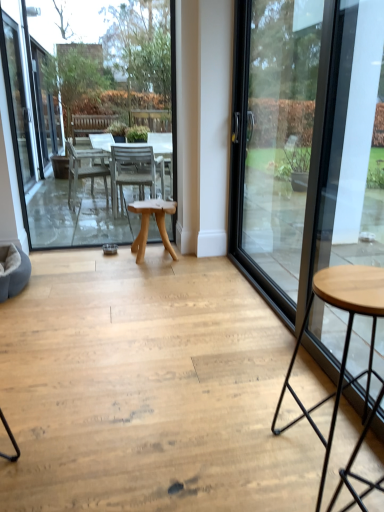
Question: From their relative heights in the image, would you say wooden table at center is taller or shorter than natural wood table at center?

Choices:
 (A) tall
 (B) short

Answer: (A)

Question: Do you think wooden table at center is within natural wood table at center, or outside of it?

Choices:
 (A) inside
 (B) outside

Answer: (B)

Question: Which object is the closest to the metallic black stool at lower right?

Choices:
 (A) wooden table at center
 (B) transparent glass door at right
 (C) natural wood table at center

Answer: (B)

Question: Considering the real-world distances, which object is closest to the natural wood table at center?

Choices:
 (A) transparent glass door at right
 (B) wooden table at center
 (C) metallic black stool at lower right

Answer: (A)